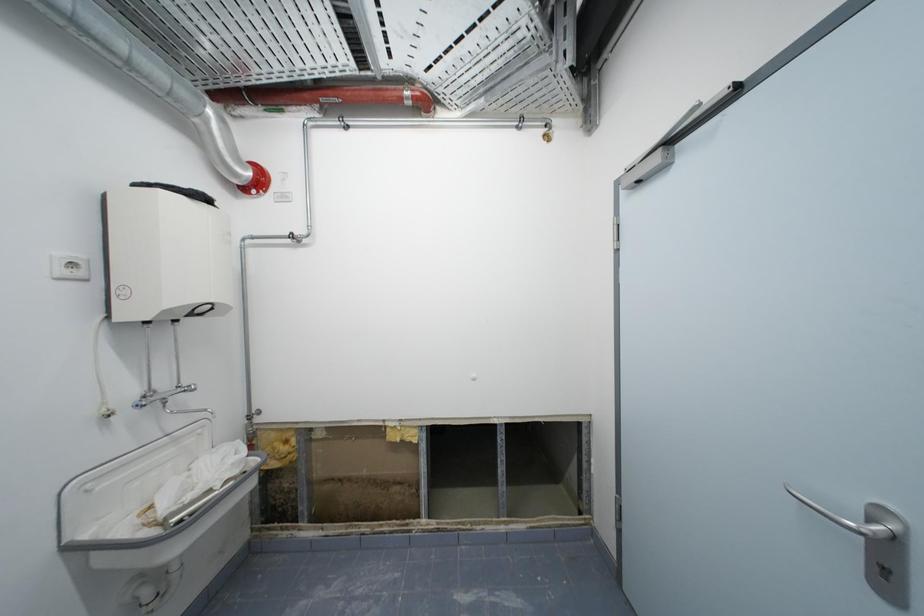
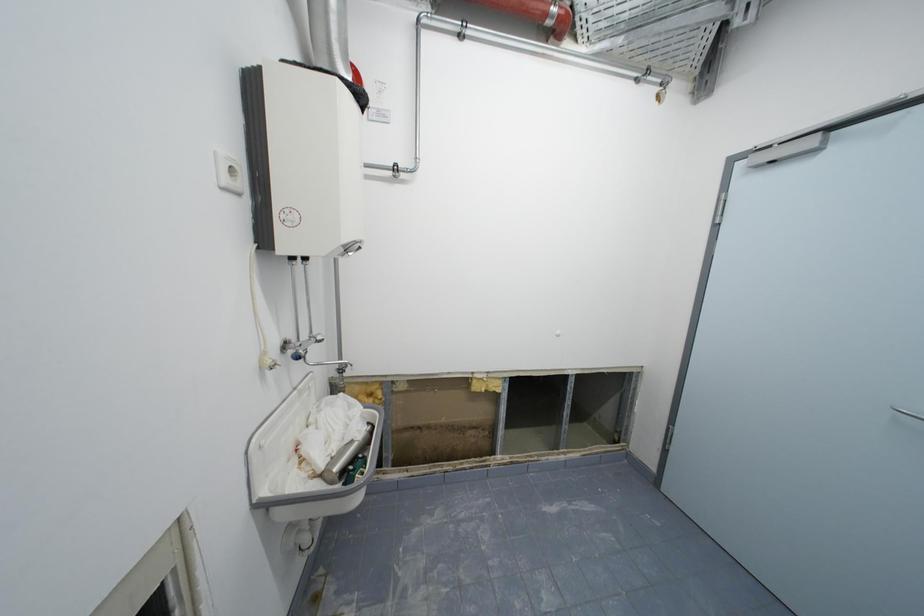
Question: Which direction would the cameraman need to move to produce the second image? Reply with the corresponding letter.

Choices:
 (A) Left
 (B) Right
 (C) Forward
 (D) Backward

Answer: (A)